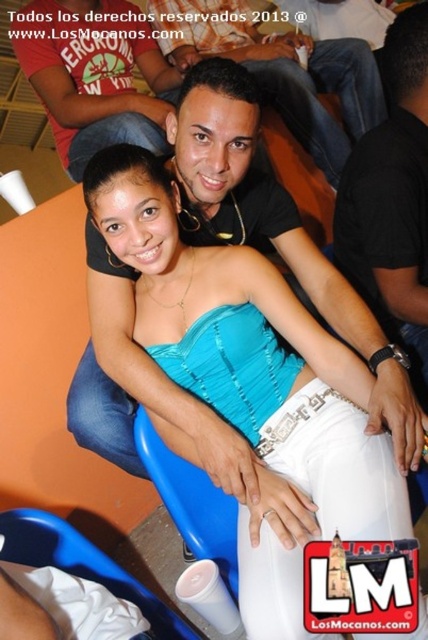
Where is `black matte shirt at upper center`? The image size is (428, 640). black matte shirt at upper center is located at coordinates (392, 198).

How far apart are black matte shirt at upper center and matte black shirt at center?

27.96 inches

Find the location of a particular element. Image resolution: width=428 pixels, height=640 pixels. black matte shirt at upper center is located at coordinates (392, 198).

I want to click on black matte shirt at upper center, so click(x=392, y=198).

Is teal satin strapless top at center positioned behind black matte shirt at upper center?

That is False.

Can you confirm if teal satin strapless top at center is positioned to the right of black matte shirt at upper center?

In fact, teal satin strapless top at center is to the left of black matte shirt at upper center.

Describe the element at coordinates (249, 349) in the screenshot. The image size is (428, 640). I see `teal satin strapless top at center` at that location.

This screenshot has height=640, width=428. I want to click on teal satin strapless top at center, so click(249, 349).

Between black matte shirt at upper center and blue plastic chair at lower center, which one appears on the left side from the viewer's perspective?

blue plastic chair at lower center

Does point (374, 134) lie behind point (50, 528)?

Yes, point (374, 134) is behind point (50, 528).

The width and height of the screenshot is (428, 640). In order to click on black matte shirt at upper center in this screenshot , I will do `click(392, 198)`.